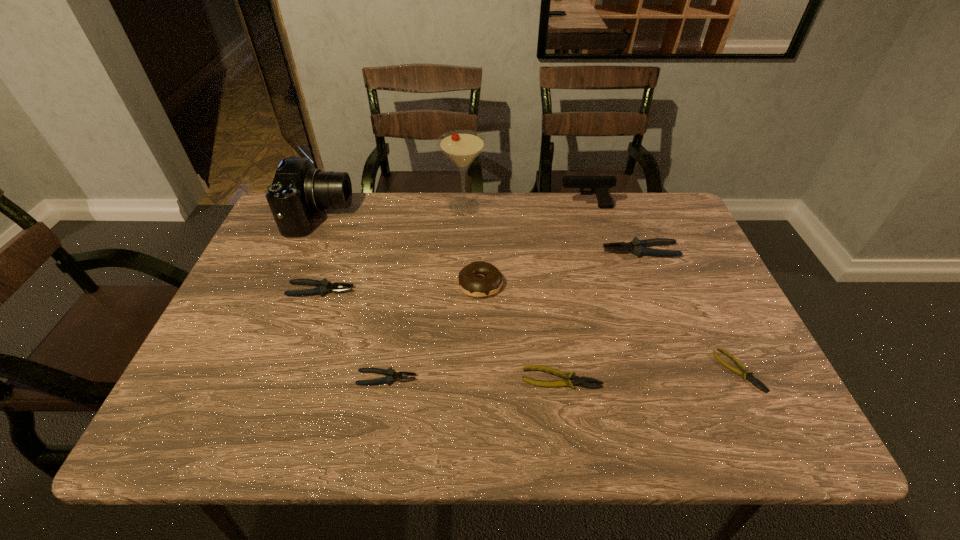
Find the location of `martini`. martini is located at coordinates (462, 147).

Where is `camera`? This screenshot has width=960, height=540. camera is located at coordinates (298, 190).

Locate an element on the screen. pistol is located at coordinates (600, 185).

At what (x,y) coordinates should I click in order to perform the action: click on the sixth shortest object. Please return your answer as a coordinate pair (x, y). The height and width of the screenshot is (540, 960). Looking at the image, I should click on tap(491, 282).

Where is `doughnut`? The height and width of the screenshot is (540, 960). doughnut is located at coordinates (491, 282).

Locate an element on the screen. Image resolution: width=960 pixels, height=540 pixels. the tallest pliers is located at coordinates (638, 247).

Image resolution: width=960 pixels, height=540 pixels. I want to click on the farthest pliers, so click(638, 247).

This screenshot has height=540, width=960. In order to click on the sixth tallest object in this screenshot , I will do `click(323, 286)`.

This screenshot has width=960, height=540. What are the coordinates of `the second farthest pliers` in the screenshot? It's located at (323, 286).

Find the location of `the smallest gray pliers`. the smallest gray pliers is located at coordinates (391, 375).